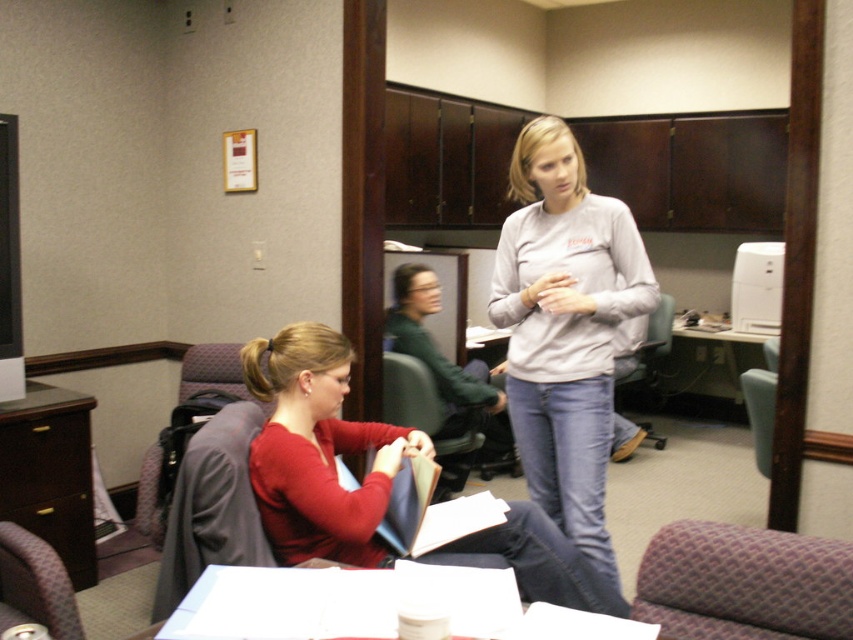
Does matte gray sweatshirt at center appear on the left side of white glossy table at center?

Indeed, matte gray sweatshirt at center is positioned on the left side of white glossy table at center.

Between matte gray sweatshirt at center and white glossy table at center, which one appears on the right side from the viewer's perspective?

From the viewer's perspective, white glossy table at center appears more on the right side.

Describe the element at coordinates (566, 326) in the screenshot. Image resolution: width=853 pixels, height=640 pixels. I see `matte gray sweatshirt at center` at that location.

Where is `matte gray sweatshirt at center`? matte gray sweatshirt at center is located at coordinates (566, 326).

In the scene shown: Does matte red sweater at center appear over white glossy table at center?

No, matte red sweater at center is not above white glossy table at center.

Does point (495, 566) come closer to viewer compared to point (718, 380)?

Yes.

The width and height of the screenshot is (853, 640). Identify the location of matte red sweater at center. (318, 451).

Can you confirm if matte gray sweatshirt at center is shorter than matte red sweater at center?

Incorrect, matte gray sweatshirt at center's height does not fall short of matte red sweater at center's.

Does point (531, 188) come closer to viewer compared to point (308, 499)?

No, it is behind (308, 499).

This screenshot has width=853, height=640. I want to click on matte gray sweatshirt at center, so click(x=566, y=326).